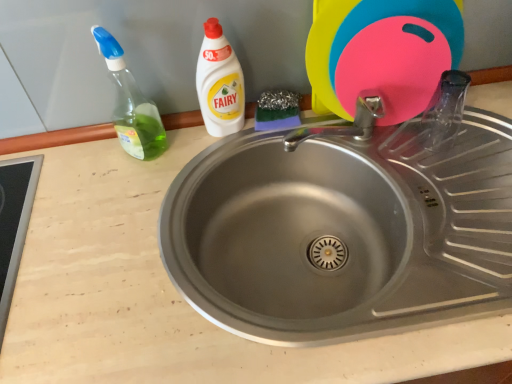
Image resolution: width=512 pixels, height=384 pixels. What do you see at coordinates (344, 232) in the screenshot?
I see `stainless steel sink at center` at bounding box center [344, 232].

Identify the location of pink rubber cutting board at upper right. The height and width of the screenshot is (384, 512). (381, 53).

This screenshot has width=512, height=384. I want to click on stainless steel sink at center, so click(344, 232).

Measure the distance from green translucent bottle at left to pink rubber cutting board at upper right.

They are 17.30 inches apart.

Considering the sizes of objects green translucent bottle at left and pink rubber cutting board at upper right in the image provided, who is smaller, green translucent bottle at left or pink rubber cutting board at upper right?

Smaller between the two is green translucent bottle at left.

The width and height of the screenshot is (512, 384). I want to click on bottle beneath the pink rubber cutting board at upper right (from a real-world perspective), so [x=131, y=104].

Can you confirm if green translucent bottle at left is thinner than pink rubber cutting board at upper right?

Yes, green translucent bottle at left is thinner than pink rubber cutting board at upper right.

Is white plastic bottle at upper center next to stainless steel sink at center and touching it?

They are not placed beside each other.

Does point (203, 103) come in front of point (463, 249)?

No, (203, 103) is behind (463, 249).

In the scene shown: Does white plastic bottle at upper center appear on the left side of stainless steel sink at center?

Yes.

Is white plastic bottle at upper center aimed at stainless steel sink at center?

No, white plastic bottle at upper center does not turn towards stainless steel sink at center.

Does point (486, 148) lie in front of point (105, 57)?

No, it is behind (105, 57).

From the image's perspective, is stainless steel sink at center on green translucent bottle at left?

Actually, stainless steel sink at center appears below green translucent bottle at left in the image.

Could you tell me if stainless steel sink at center is turned towards green translucent bottle at left?

No, stainless steel sink at center is not aimed at green translucent bottle at left.

Is stainless steel sink at center far away from green translucent bottle at left?

They are positioned close to each other.

Considering the sizes of objects pink rubber cutting board at upper right and green translucent bottle at left in the image provided, who is smaller, pink rubber cutting board at upper right or green translucent bottle at left?

green translucent bottle at left.

Is pink rubber cutting board at upper right oriented away from green translucent bottle at left?

No, pink rubber cutting board at upper right is not facing the opposite direction of green translucent bottle at left.

From a real-world perspective, is pink rubber cutting board at upper right physically below green translucent bottle at left?

No, from a real-world perspective, pink rubber cutting board at upper right is not under green translucent bottle at left.

From a real-world perspective, between white plastic bottle at upper center and green translucent bottle at left, who is vertically higher?

green translucent bottle at left.

Is white plastic bottle at upper center wider or thinner than green translucent bottle at left?

In the image, white plastic bottle at upper center appears to be more narrow than green translucent bottle at left.

From the image's perspective, is white plastic bottle at upper center over green translucent bottle at left?

Yes, from the image's perspective, white plastic bottle at upper center is on top of green translucent bottle at left.

In the scene shown: From a real-world perspective, is green translucent bottle at left on stainless steel sink at center?

Yes, from a real-world perspective, green translucent bottle at left is on top of stainless steel sink at center.

Considering the sizes of green translucent bottle at left and stainless steel sink at center in the image, is green translucent bottle at left taller or shorter than stainless steel sink at center?

Considering their sizes, green translucent bottle at left has more height than stainless steel sink at center.

Looking at the image, does green translucent bottle at left seem bigger or smaller compared to stainless steel sink at center?

green translucent bottle at left is smaller than stainless steel sink at center.

Which of these two, stainless steel sink at center or white plastic bottle at upper center, is bigger?

stainless steel sink at center.

Does stainless steel sink at center touch white plastic bottle at upper center?

No, stainless steel sink at center is not next to white plastic bottle at upper center.

Looking at this image, is stainless steel sink at center positioned in front of white plastic bottle at upper center?

Yes, stainless steel sink at center is closer to the camera.

Where is `bottle located below the pink rubber cutting board at upper right (from the image's perspective)`? bottle located below the pink rubber cutting board at upper right (from the image's perspective) is located at coordinates (131, 104).

You are a GUI agent. You are given a task and a screenshot of the screen. Output one action in this format:
    pyautogui.click(x=<x>, y=<y>)
    Task: Click on the cleaning product above the stainless steel sink at center (from the image's perspective)
    The width and height of the screenshot is (512, 384).
    Given the screenshot: What is the action you would take?
    pyautogui.click(x=219, y=83)

Considering their positions, is white plastic bottle at upper center positioned closer to green translucent bottle at left than pink rubber cutting board at upper right?

Based on the image, white plastic bottle at upper center appears to be nearer to green translucent bottle at left.

Considering their positions, is white plastic bottle at upper center positioned further to pink rubber cutting board at upper right than stainless steel sink at center?

Based on the image, white plastic bottle at upper center appears to be further to pink rubber cutting board at upper right.

Estimate the real-world distances between objects in this image. Which object is closer to pink rubber cutting board at upper right, green translucent bottle at left or stainless steel sink at center?

Among the two, stainless steel sink at center is located nearer to pink rubber cutting board at upper right.

Based on their spatial positions, is pink rubber cutting board at upper right or stainless steel sink at center further from white plastic bottle at upper center?

stainless steel sink at center is positioned further to the anchor white plastic bottle at upper center.

Estimate the real-world distances between objects in this image. Which object is further from green translucent bottle at left, pink rubber cutting board at upper right or stainless steel sink at center?

pink rubber cutting board at upper right is further to green translucent bottle at left.

From the image, which object appears to be nearer to green translucent bottle at left, white plastic bottle at upper center or stainless steel sink at center?

Among the two, white plastic bottle at upper center is located nearer to green translucent bottle at left.

Based on their spatial positions, is stainless steel sink at center or green translucent bottle at left closer to white plastic bottle at upper center?

Based on the image, green translucent bottle at left appears to be nearer to white plastic bottle at upper center.

Considering their positions, is white plastic bottle at upper center positioned further to stainless steel sink at center than pink rubber cutting board at upper right?

The object further to stainless steel sink at center is white plastic bottle at upper center.

Image resolution: width=512 pixels, height=384 pixels. I want to click on cleaning product between green translucent bottle at left and pink rubber cutting board at upper right from left to right, so click(x=219, y=83).

Identify the location of sink situated between green translucent bottle at left and pink rubber cutting board at upper right from left to right. The height and width of the screenshot is (384, 512). tap(344, 232).

Identify the location of cleaning product between pink rubber cutting board at upper right and stainless steel sink at center vertically. (219, 83).

At what (x,y) coordinates should I click in order to perform the action: click on cleaning product located between green translucent bottle at left and stainless steel sink at center in the left-right direction. Please return your answer as a coordinate pair (x, y). The height and width of the screenshot is (384, 512). Looking at the image, I should click on (219, 83).